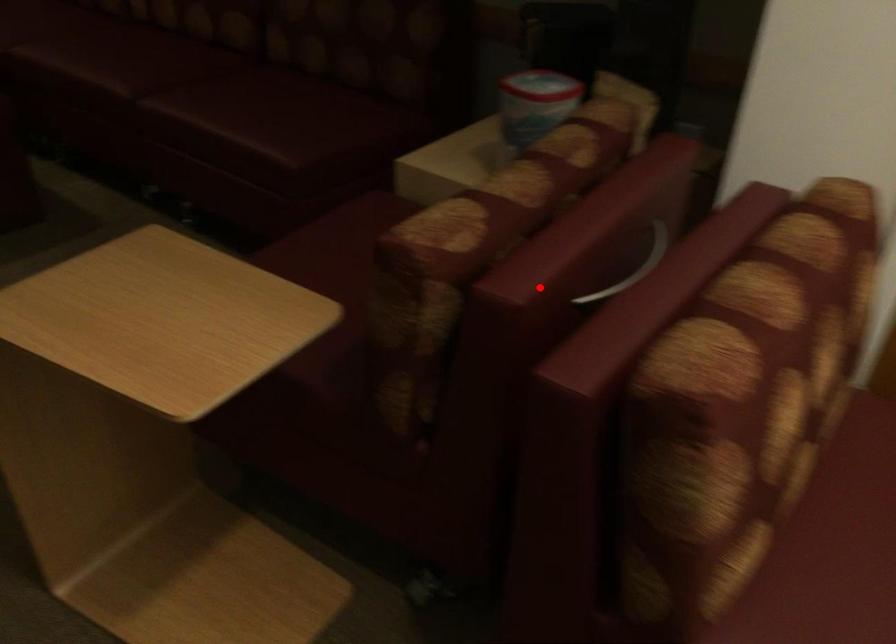
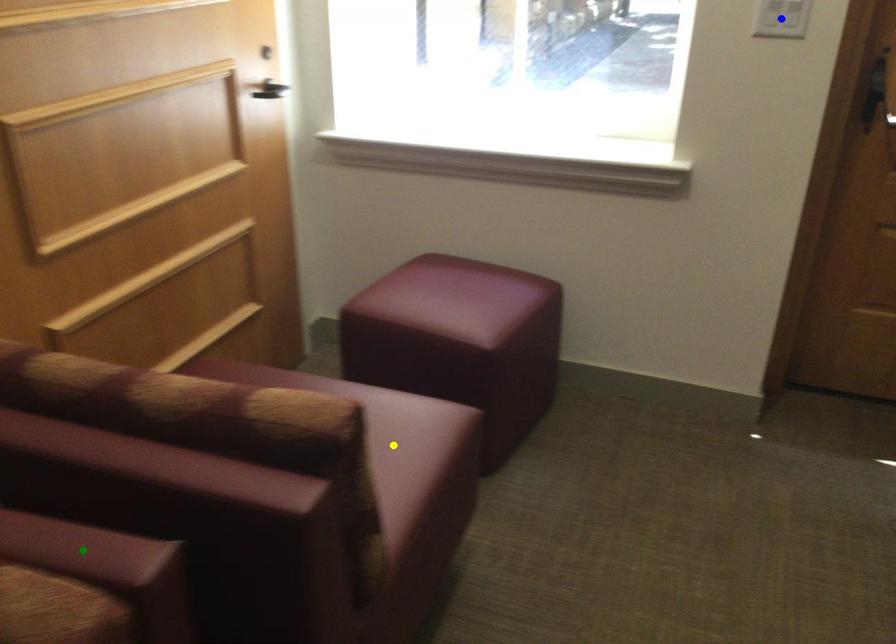
Question: I am providing you with two images of the same scene from different viewpoints. A red point is marked on the first image. You are given multiple points on the second image. Which spot in image 2 lines up with the point in image 1?

Choices:
 (A) yellow point
 (B) blue point
 (C) green point

Answer: (C)